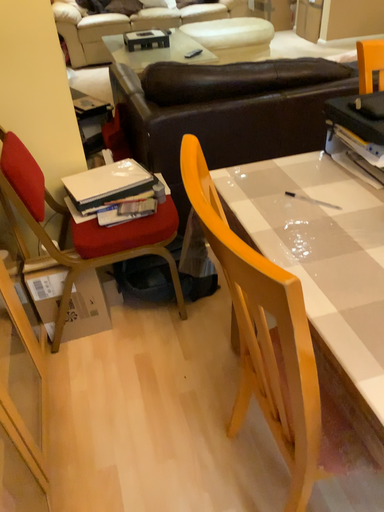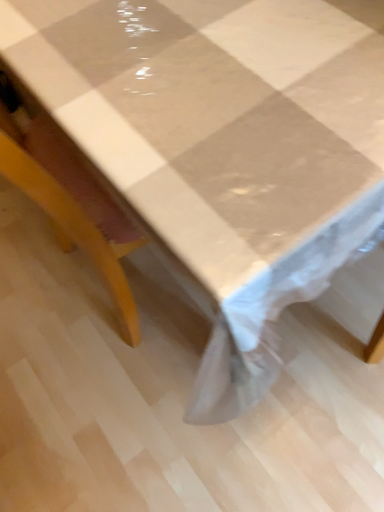
Question: Which way did the camera rotate in the video?

Choices:
 (A) rotated upward
 (B) rotated downward

Answer: (B)